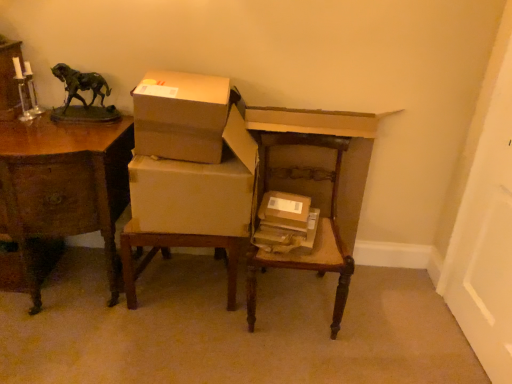
What are the coordinates of `free space in front of green patina bronze horse at upper left` in the screenshot? It's located at (62, 136).